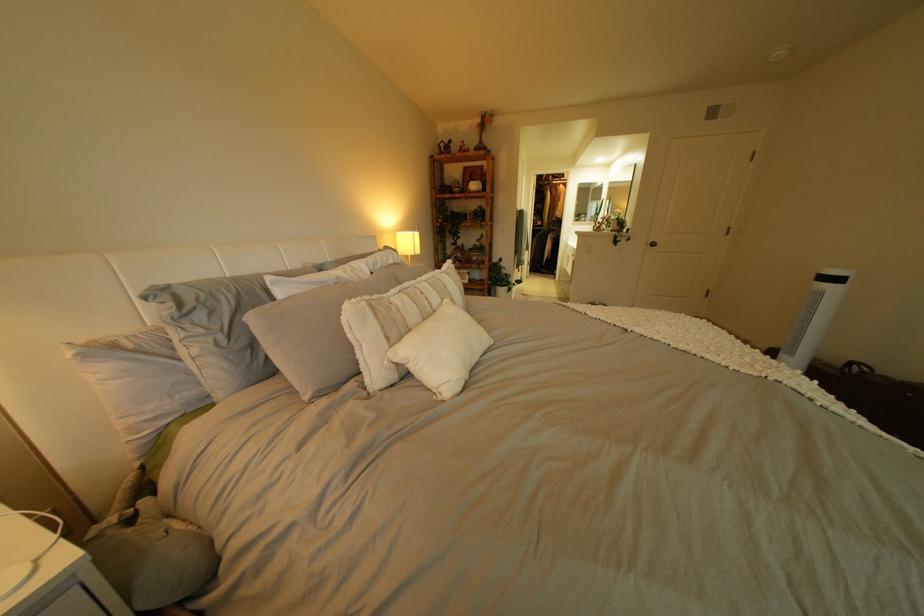
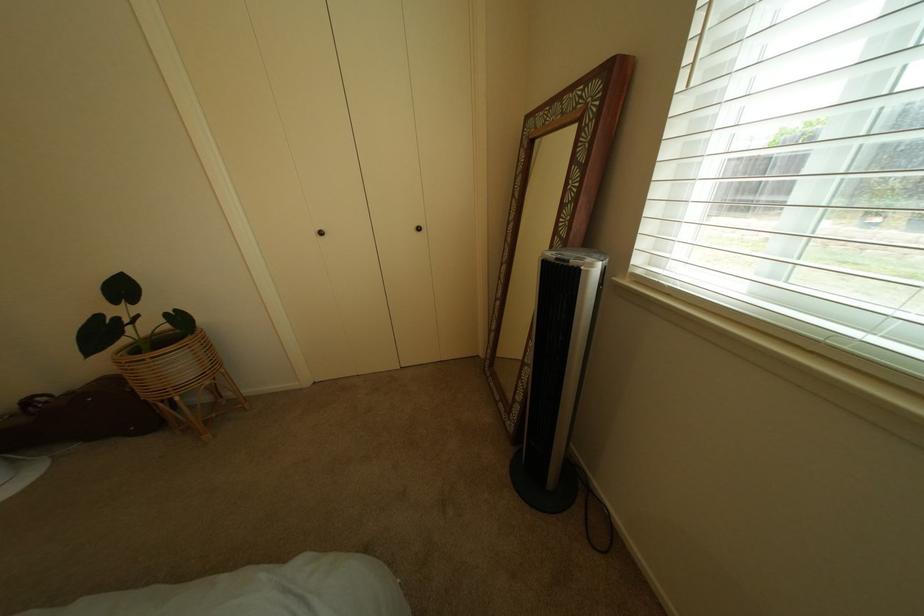
How did the camera likely rotate?

The camera rotated toward right-down.